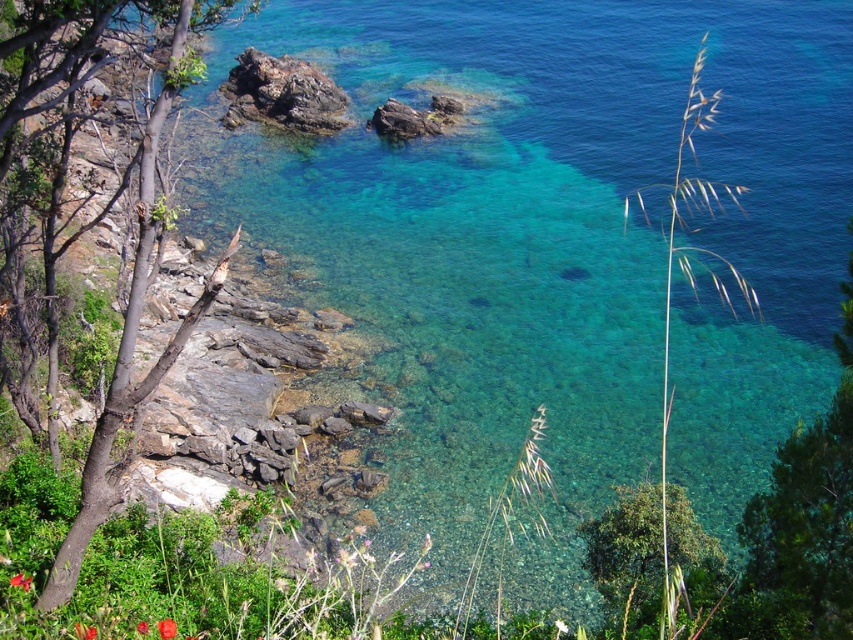
Between green leafy tree at lower right and bright red petal at center, which one has more height?

green leafy tree at lower right

Which is in front, point (680, 506) or point (27, 586)?

Point (27, 586) is more forward.

Between point (596, 540) and point (28, 582), which one is positioned behind?

The point (596, 540) is behind.

Locate an element on the screen. green leafy tree at lower right is located at coordinates (627, 554).

How much distance is there between brown bark tree at left and green leafy tree at lower right?

brown bark tree at left and green leafy tree at lower right are 39.28 feet apart from each other.

Between point (151, 252) and point (621, 531), which one is positioned behind?

The point (621, 531) is behind.

Which is in front, point (149, 224) or point (675, 492)?

Positioned in front is point (149, 224).

The width and height of the screenshot is (853, 640). Identify the location of brown bark tree at left. (136, 321).

In the scene shown: Who is taller, green leafy tree at lower right or red matte flower at lower left?

Standing taller between the two is green leafy tree at lower right.

Does green leafy tree at lower right appear under red matte flower at lower left?

Indeed, green leafy tree at lower right is positioned under red matte flower at lower left.

Describe the element at coordinates (627, 554) in the screenshot. I see `green leafy tree at lower right` at that location.

Identify the location of green leafy tree at lower right. (627, 554).